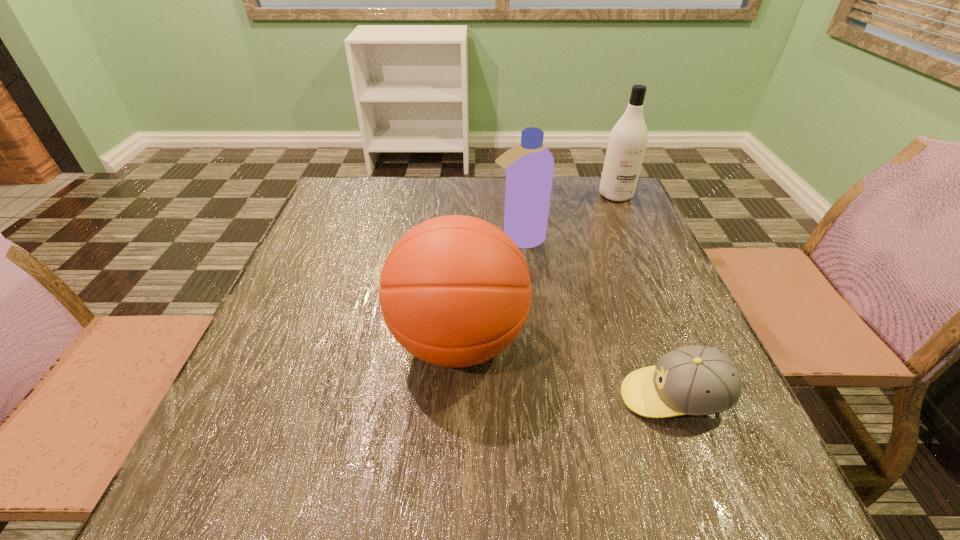
At what (x,y) coordinates should I click in order to perform the action: click on vacant space at the near left corner of the desktop. Please return your answer as a coordinate pair (x, y). The width and height of the screenshot is (960, 540). Looking at the image, I should click on (240, 482).

This screenshot has height=540, width=960. What are the coordinates of `vacant space at the far right corner` in the screenshot? It's located at tap(594, 191).

The height and width of the screenshot is (540, 960). In the image, there is a desktop. Identify the location of vacant space at the near right corner. coord(765,456).

Find the location of a particular element. blank region between the right shampoo and the basketball is located at coordinates (537, 268).

This screenshot has height=540, width=960. What are the coordinates of `free space that is in between the baseball cap and the basketball` in the screenshot? It's located at (566, 369).

You are a GUI agent. You are given a task and a screenshot of the screen. Output one action in this format:
    pyautogui.click(x=<x>, y=<y>)
    Task: Click on the free area in between the nearer shampoo and the farthest object
    Image resolution: width=960 pixels, height=540 pixels.
    Given the screenshot: What is the action you would take?
    pyautogui.click(x=567, y=217)

Where is `vacant space that is in between the left shampoo and the farthest object`? vacant space that is in between the left shampoo and the farthest object is located at coordinates (567, 217).

In order to click on free point between the shortest object and the left shampoo in this screenshot , I will do (596, 318).

The width and height of the screenshot is (960, 540). Identify the location of vacant space in between the left shampoo and the shortest object. (596, 318).

Identify the location of vacant area between the left shampoo and the shortest object. This screenshot has height=540, width=960. (596, 318).